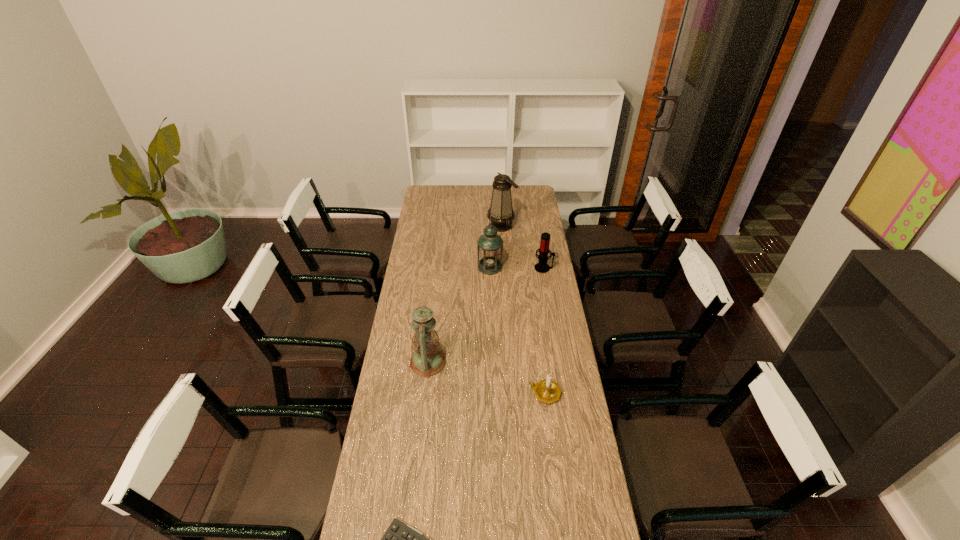
At what (x,y) coordinates should I click in order to perform the action: click on the farthest oil lamp. Please return your answer as a coordinate pair (x, y). Looking at the image, I should click on (501, 212).

This screenshot has height=540, width=960. What are the coordinates of `the fourth farthest object` in the screenshot? It's located at (427, 360).

You are a GUI agent. You are given a task and a screenshot of the screen. Output one action in this format:
    pyautogui.click(x=<x>, y=<y>)
    Task: Click on the nearest oil lamp
    The height and width of the screenshot is (540, 960).
    Given the screenshot: What is the action you would take?
    pyautogui.click(x=427, y=360)

Identify the location of the second farthest oil lamp. Image resolution: width=960 pixels, height=540 pixels. (490, 245).

Where is `the fourth tallest object`? the fourth tallest object is located at coordinates (542, 267).

Find the location of a particular element. This screenshot has width=960, height=540. the second shortest object is located at coordinates (548, 391).

At what (x,y) coordinates should I click in order to perform the action: click on the fifth farthest object. Please return your answer as a coordinate pair (x, y). Looking at the image, I should click on (548, 391).

What are the coordinates of `vacant space located 0.380m on the back of the farthest oil lamp` in the screenshot? It's located at (499, 185).

Where is `vacant space located 0.200m on the right of the nearest oil lamp`? The width and height of the screenshot is (960, 540). vacant space located 0.200m on the right of the nearest oil lamp is located at coordinates click(494, 362).

Where is `vacant position located 0.240m on the right of the second farthest oil lamp`? vacant position located 0.240m on the right of the second farthest oil lamp is located at coordinates (549, 267).